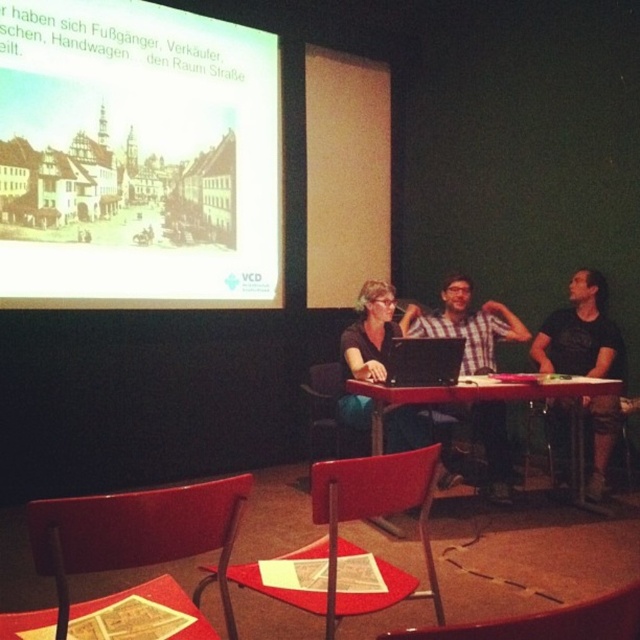
Question: Which of these objects is positioned closest to the yellowish paper slide at upper left?

Choices:
 (A) metallic red chair at lower center
 (B) checkered fabric shirt at center
 (C) matte wooden table at center
 (D) black matte laptop at center

Answer: (B)

Question: Which of the following is the farthest from the observer?

Choices:
 (A) matte red chair at lower left
 (B) checkered fabric shirt at center
 (C) yellowish paper slide at upper left

Answer: (B)

Question: Considering the real-world distances, which object is farthest from the metallic red chair at lower center?

Choices:
 (A) yellowish paper slide at upper left
 (B) matte red chair at lower center
 (C) black t-shirt at right
 (D) matte red chair at lower left

Answer: (A)

Question: In this image, where is yellowish paper slide at upper left located relative to matte red chair at lower center?

Choices:
 (A) below
 (B) above

Answer: (B)

Question: In this image, where is metallic red chair at lower center located relative to black matte laptop at center?

Choices:
 (A) right
 (B) left

Answer: (B)

Question: Is yellowish paper slide at upper left wider than checkered fabric shirt at center?

Choices:
 (A) yes
 (B) no

Answer: (A)